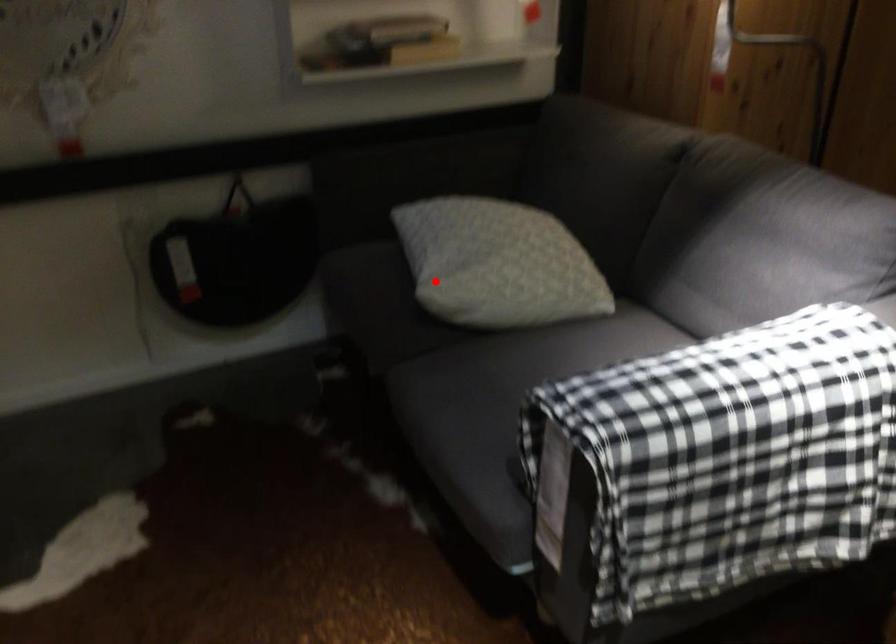
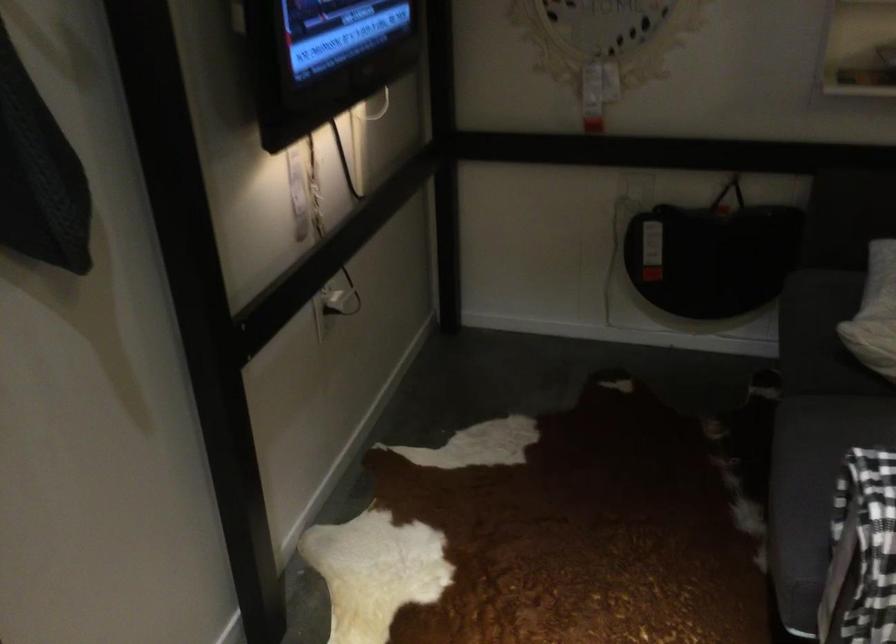
Question: I am providing you with two images of the same scene from different viewpoints. In image1, a red point is highlighted. Considering the same 3D point in image2, which of the following is correct?

Choices:
 (A) It is closer
 (B) It is farther

Answer: (A)